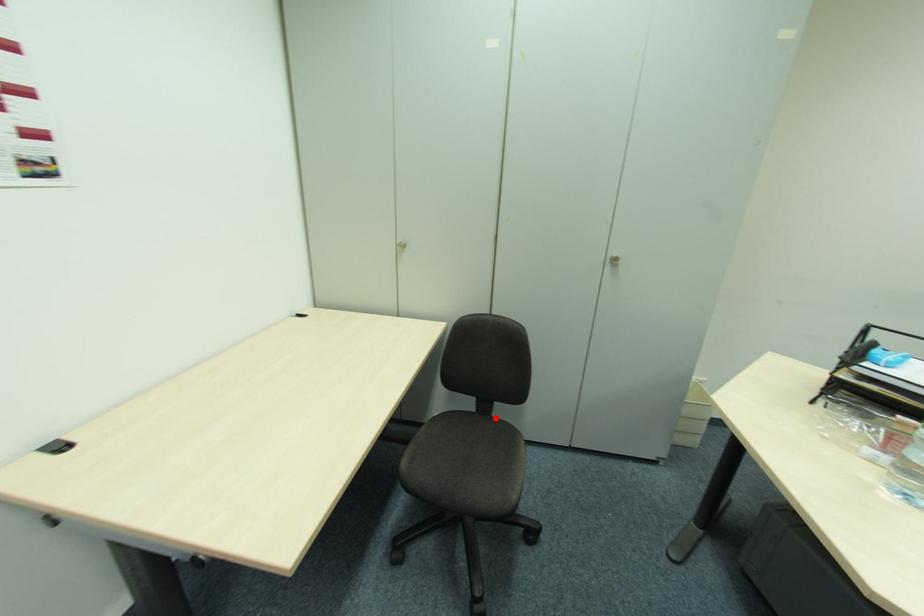
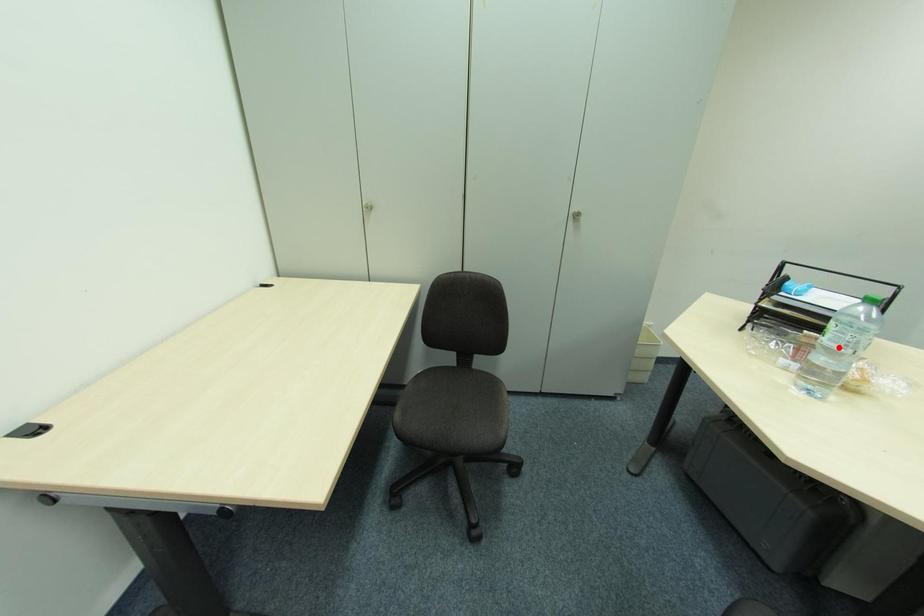
I am providing you with two images of the same scene from different viewpoints. A red point is marked on the first image and another point is marked on the second image. Do the highlighted points in image1 and image2 indicate the same real-world spot?

No